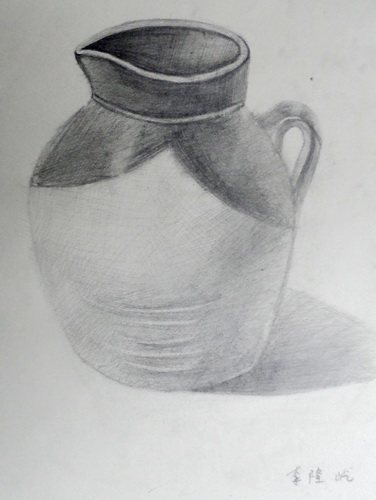
The height and width of the screenshot is (500, 376). In order to click on jug in this screenshot , I will do `click(177, 227)`.